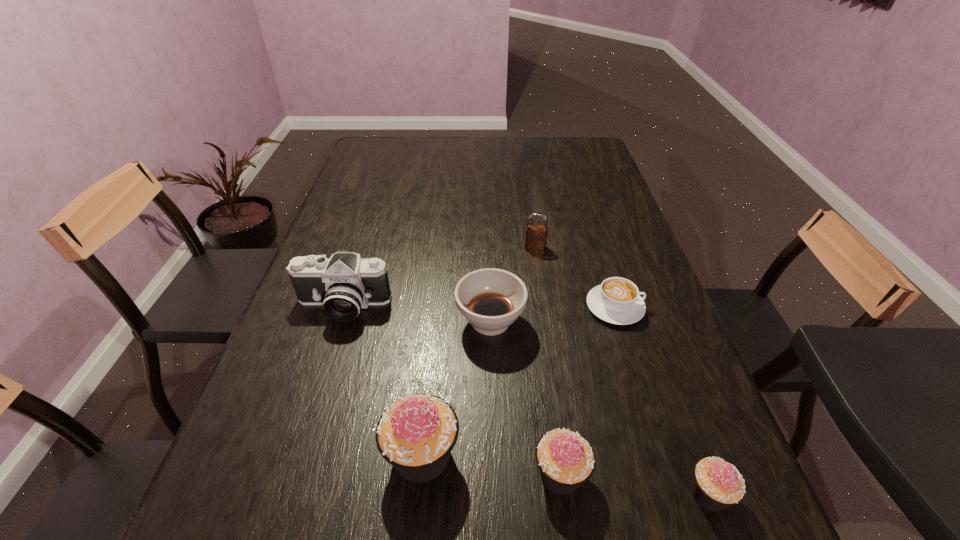
Identify the location of vacant area that lies between the second cupcake from right to left and the leftmost cupcake. (492, 464).

The height and width of the screenshot is (540, 960). In order to click on object that can be found as the closest to the leftmost cupcake in this screenshot , I will do `click(566, 460)`.

Where is `the fourth closest object relative to the second shortest cupcake`? The height and width of the screenshot is (540, 960). the fourth closest object relative to the second shortest cupcake is located at coordinates (617, 300).

Identify which cupcake is located as the second nearest to the tallest object. Please provide its 2D coordinates. Your answer should be formatted as a tuple, i.e. [(x, y)], where the tuple contains the x and y coordinates of a point satisfying the conditions above.

[(717, 484)]

Identify the location of cupcake that stands as the third closest to the shortest object. The height and width of the screenshot is (540, 960). (416, 434).

Identify the location of vacant space that satisfies the following two spatial constraints: 1. on the back side of the shortest cupcake; 2. on the side of the cappuccino with the handle. (639, 307).

What are the coordinates of `free space that satisfies the following two spatial constraints: 1. on the side of the shortest object with the handle; 2. on the right side of the shortest cupcake` in the screenshot? It's located at (674, 494).

The height and width of the screenshot is (540, 960). I want to click on free space that satisfies the following two spatial constraints: 1. on the side of the cappuccino with the handle; 2. on the left side of the rightmost cupcake, so click(674, 494).